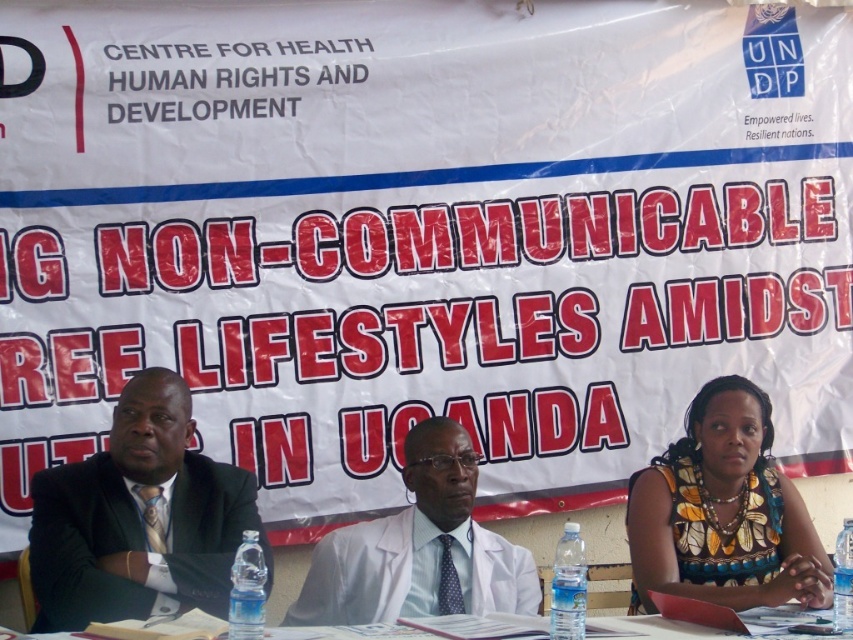
You are organizing a photo shoot for the event and need to ensure that all panelists are visible in the frame. Given the spatial arrangement of the black suit at left and the floral fabric dress at lower right, which panelist should you position closer to the camera to maintain visibility?

The black suit at left occupies less space than the floral fabric dress at lower right, so positioning the black suit at left closer to the camera would help maintain visibility as it requires less space to be fully visible.

Consider the image. Based on the scene described, which object is placed above the other between the white lab coat at center and the clear plastic water bottles at lower center?

The white lab coat at center is positioned over the clear plastic water bottles at lower center, meaning it is placed above them.

Consider the image. You are a photographer at the event and want to take a closeup of the two points mentioned. Which point is closer to you, point A at (396, 614) or point B at (728, 634)?

Point A at (396, 614) is closer to you than point B at (728, 634).